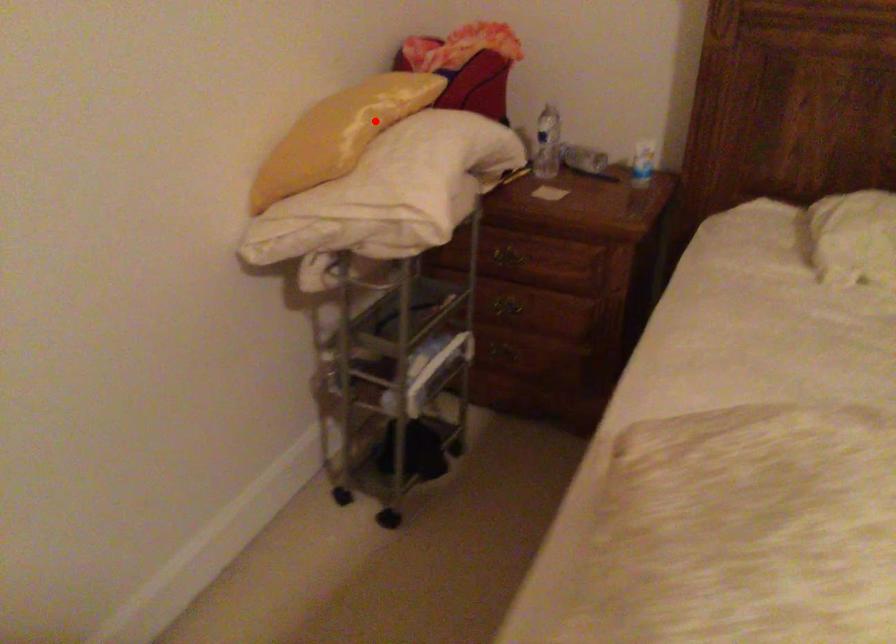
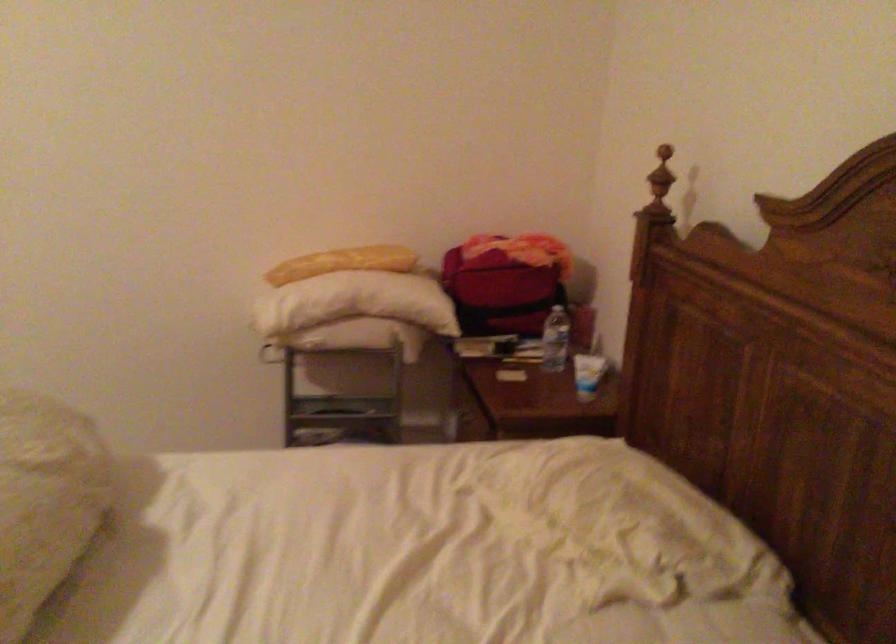
Question: I am providing you with two images of the same scene from different viewpoints. Image1 has a red point marked. In image2, the corresponding 3D location appears at what relative position? Reply with the corresponding letter.

Choices:
 (A) Closer
 (B) Farther

Answer: (B)